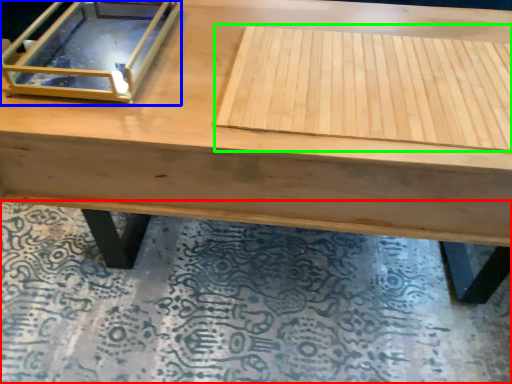
Question: Which is farther away from mat (highlighted by a red box)? glass box (highlighted by a blue box) or plywood (highlighted by a green box)?

Choices:
 (A) glass box
 (B) plywood

Answer: (A)